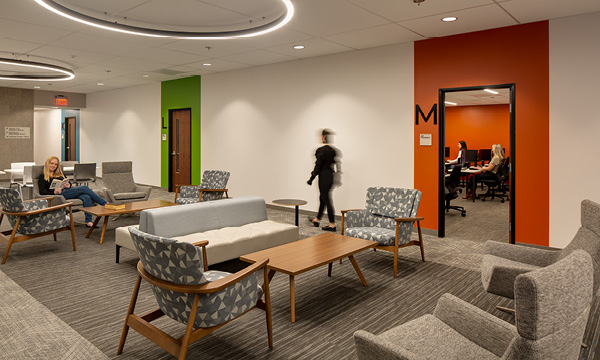
Locate an element on the screen. Image resolution: width=600 pixels, height=360 pixels. 4 gray fabric chairs is located at coordinates pyautogui.click(x=460, y=329), pyautogui.click(x=507, y=267), pyautogui.click(x=113, y=179), pyautogui.click(x=38, y=184).